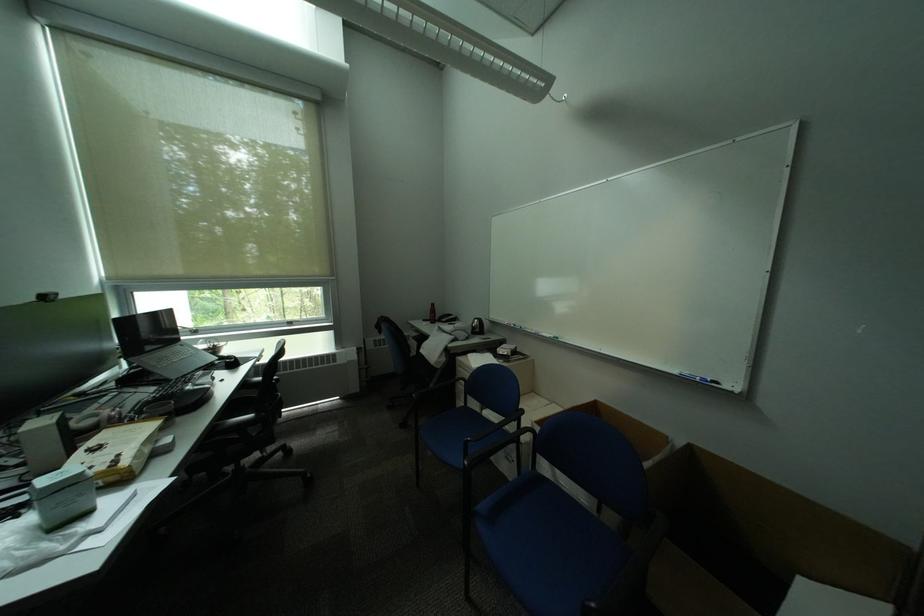
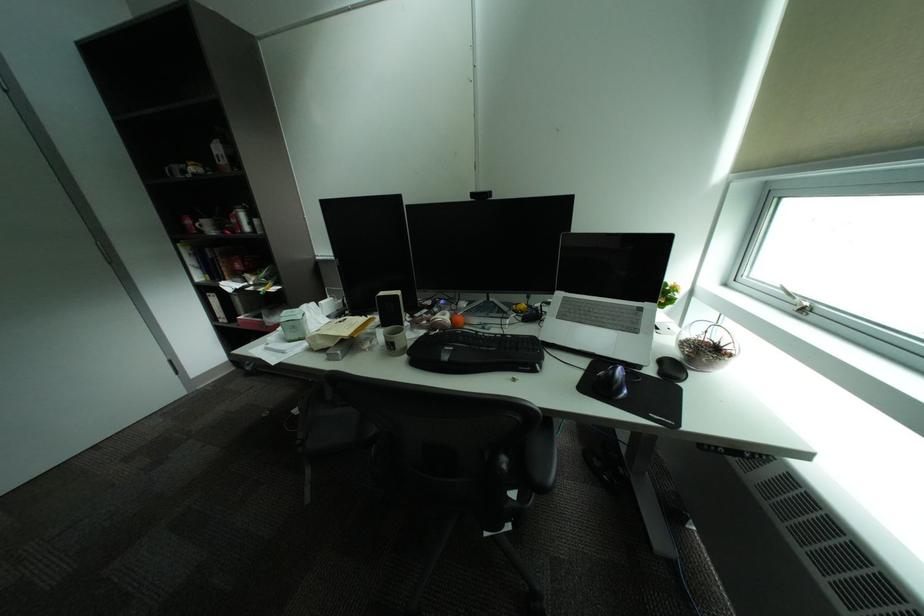
The point at (167,392) is marked in the first image. Where is the corresponding point in the second image?

(516, 336)